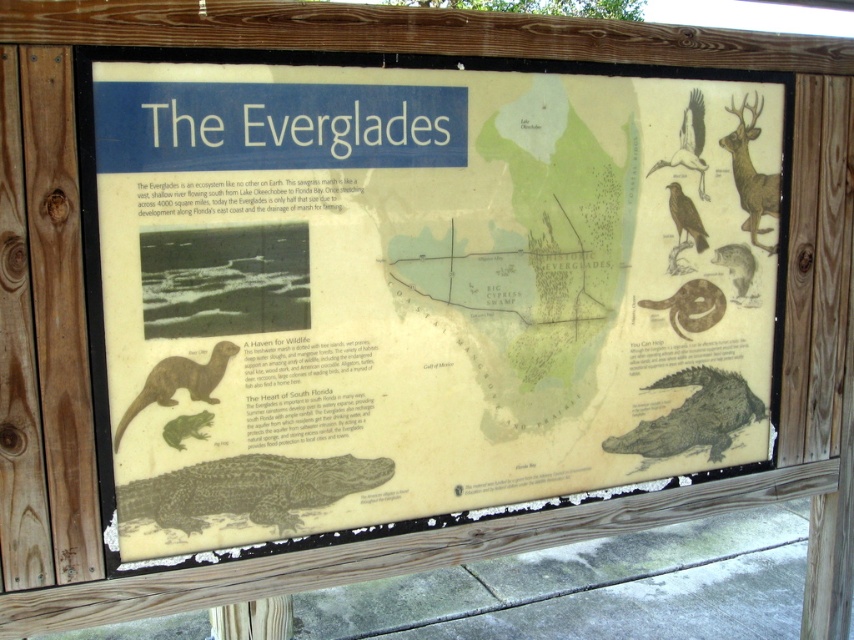
You are a park ranger guiding visitors to the Everglades. You point to the signboard and ask them to identify which animal is closer to the front of the signboard between the dark green scaly alligator at center and the green scaly crocodile at lower right. What should they answer?

The dark green scaly alligator at center is closer to the front of the signboard because it is positioned in front of the green scaly crocodile at lower right.

You are a visitor at the Everglades and see the dark green scaly alligator at center and the brown velvet deer at upper right on the signboard. Which animal is closer to you on the signboard?

The dark green scaly alligator at center is closer to you because it is in front of the brown velvet deer at upper right.